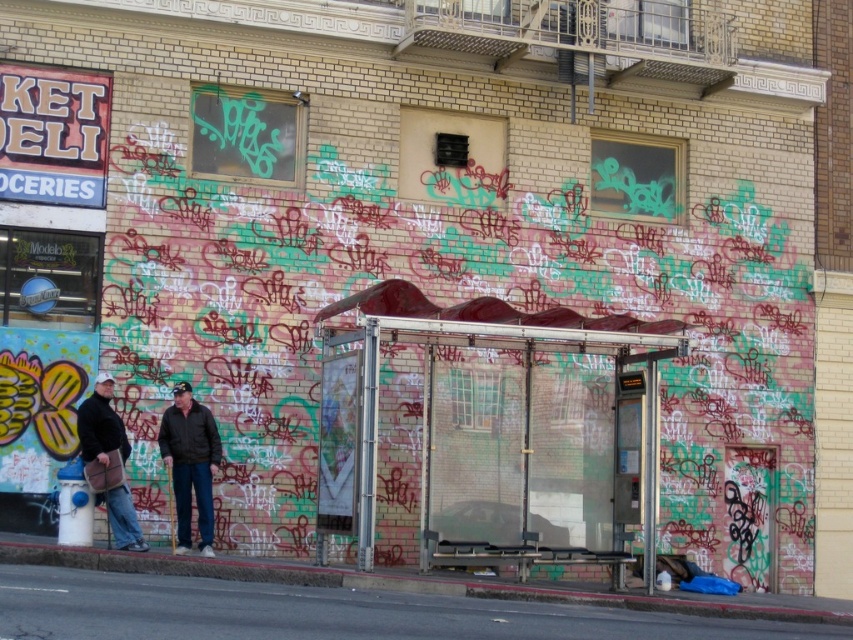
You are waiting at the bus stop and see a dark brown leather jacket at center and a transparent glass bus stop at center. Which object is closer to the graffiti wall?

The dark brown leather jacket at center is closer to the graffiti wall because the transparent glass bus stop at center is positioned on the right side of it, meaning the jacket is between the wall and the bus stop.

You are a photographer standing at the camera position. You want to take a photo of the graffiti on the wall behind the transparent glass bus stop at center. Since the bus stop is in the way, can you move closer to the wall to capture the graffiti without the bus stop in the frame?

The transparent glass bus stop at center is 16.09 meters from camera. Moving closer to the wall would require moving past the bus stop, but since the bus stop is already between you and the wall, moving closer would not remove it from the frame unless you go around it. Therefore, you cannot capture the graffiti without the bus stop in the frame unless you reposition yourself to the side or behind the shelter.

You are a delivery person trying to place a large package that is 1.8 meters wide. You see the transparent glass bus stop at center and the dark brown leather jacket at left. Which object can the package fit next to without overlapping?

The transparent glass bus stop at center has a greater width than the dark brown leather jacket at left. Since the package is 1.8 meters wide, it can fit next to the transparent glass bus stop at center as it is wider and provides enough space.